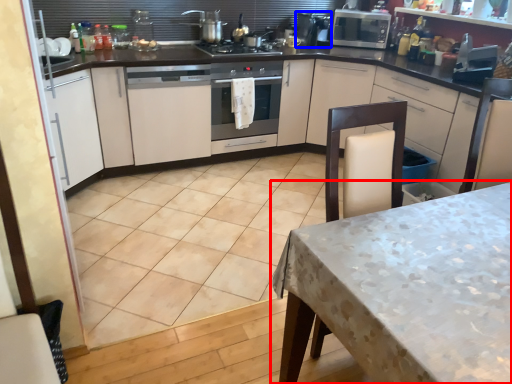
Question: Among these objects, which one is farthest to the camera, table (highlighted by a red box) or appliance (highlighted by a blue box)?

Choices:
 (A) table
 (B) appliance

Answer: (B)